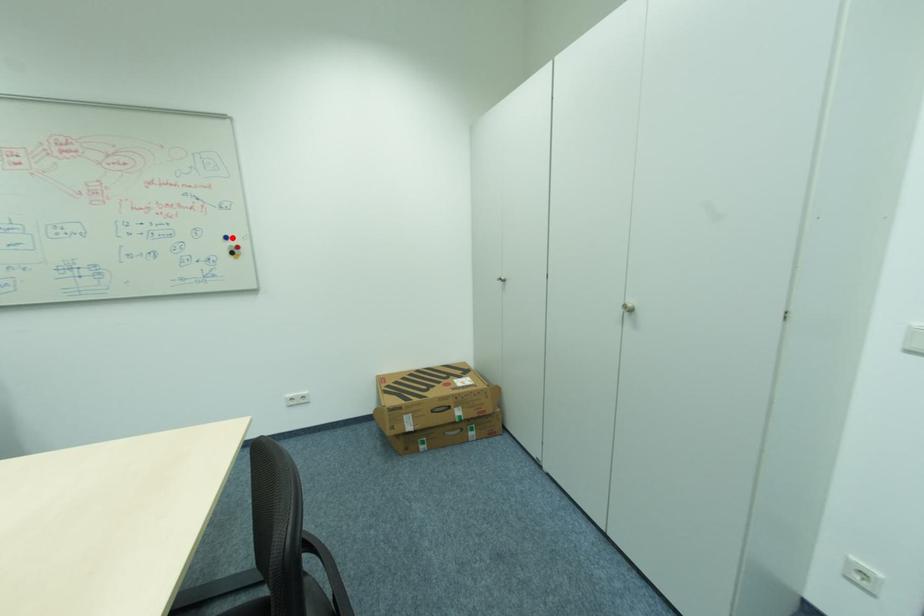
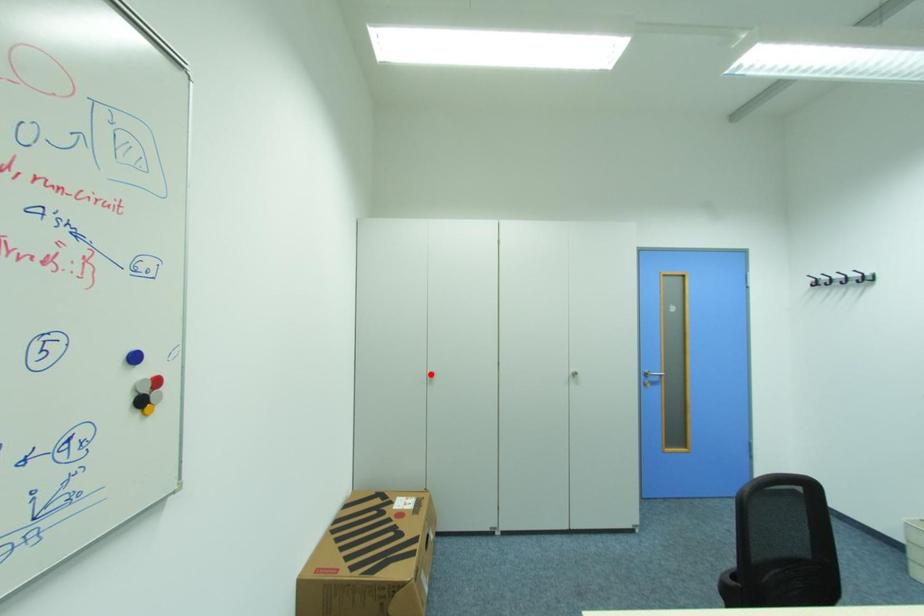
I am providing you with two images of the same scene from different viewpoints. A red point is marked on the first image and another point is marked on the second image. Does the point marked in image1 correspond to the same location as the one in image2?

No